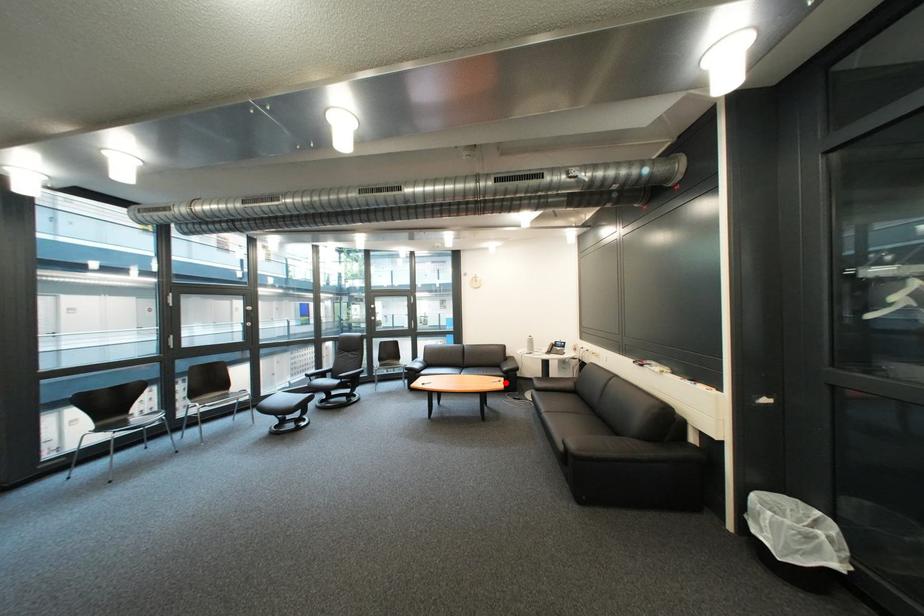
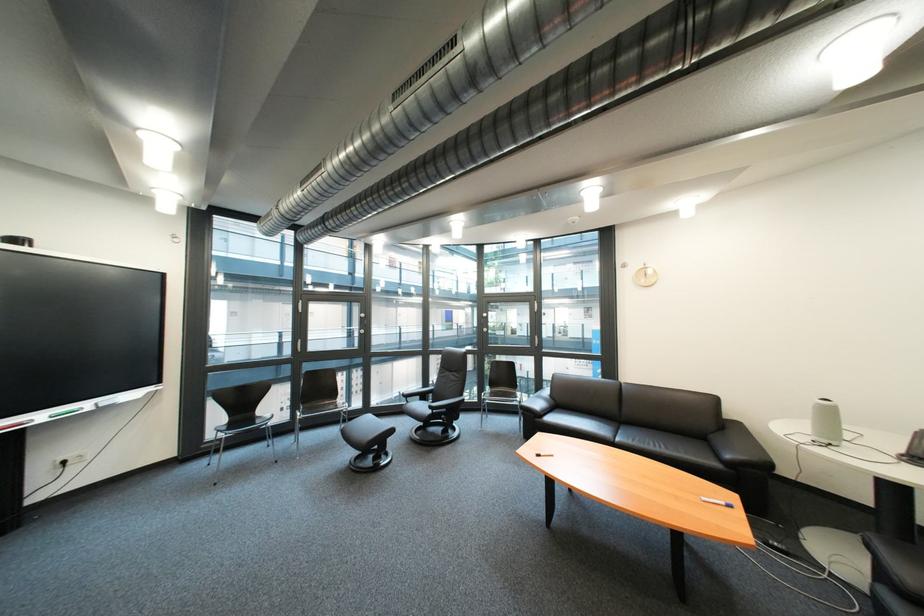
Question: I am providing you with two images of the same scene from different viewpoints. Given a red point in image1, look at the same physical point in image2. Is it:

Choices:
 (A) Closer to the viewpoint
 (B) Farther from the viewpoint

Answer: (B)